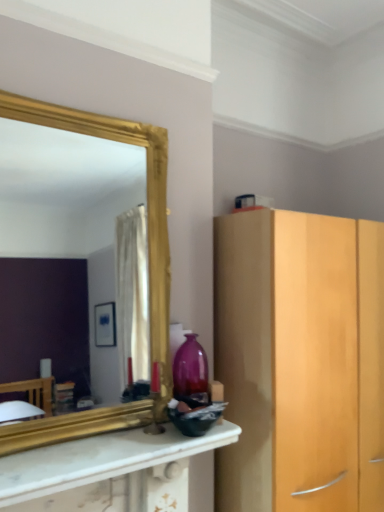
Question: Can you confirm if gold-framed mirror at upper left is taller than white marble countertop at center?

Choices:
 (A) no
 (B) yes

Answer: (B)

Question: Does gold-framed mirror at upper left have a lesser width compared to white marble countertop at center?

Choices:
 (A) yes
 (B) no

Answer: (A)

Question: From the image's perspective, would you say gold-framed mirror at upper left is shown under white marble countertop at center?

Choices:
 (A) no
 (B) yes

Answer: (A)

Question: Is white marble countertop at center inside gold-framed mirror at upper left?

Choices:
 (A) yes
 (B) no

Answer: (B)

Question: Is gold-framed mirror at upper left facing away from white marble countertop at center?

Choices:
 (A) no
 (B) yes

Answer: (A)

Question: From the image's perspective, relative to gold-framed mirror at upper left, is matte purple glass vase at center above or below?

Choices:
 (A) above
 (B) below

Answer: (B)

Question: From a real-world perspective, relative to gold-framed mirror at upper left, is matte purple glass vase at center vertically above or below?

Choices:
 (A) below
 (B) above

Answer: (A)

Question: Does point (203, 348) appear closer or farther from the camera than point (99, 237)?

Choices:
 (A) farther
 (B) closer

Answer: (B)

Question: Considering the positions of matte purple glass vase at center and gold-framed mirror at upper left in the image, is matte purple glass vase at center taller or shorter than gold-framed mirror at upper left?

Choices:
 (A) short
 (B) tall

Answer: (A)

Question: Considering their positions, is gold-framed mirror at upper left located in front of or behind matte purple glass vase at center?

Choices:
 (A) behind
 (B) front

Answer: (B)

Question: Considering the positions of gold-framed mirror at upper left and matte purple glass vase at center in the image, is gold-framed mirror at upper left taller or shorter than matte purple glass vase at center?

Choices:
 (A) short
 (B) tall

Answer: (B)

Question: From a real-world perspective, is gold-framed mirror at upper left physically located above or below matte purple glass vase at center?

Choices:
 (A) above
 (B) below

Answer: (A)

Question: From the image's perspective, is gold-framed mirror at upper left located above or below matte purple glass vase at center?

Choices:
 (A) below
 (B) above

Answer: (B)

Question: Is white marble countertop at center inside or outside of matte purple glass vase at center?

Choices:
 (A) outside
 (B) inside

Answer: (A)

Question: Considering the positions of white marble countertop at center and matte purple glass vase at center in the image, is white marble countertop at center wider or thinner than matte purple glass vase at center?

Choices:
 (A) thin
 (B) wide

Answer: (B)